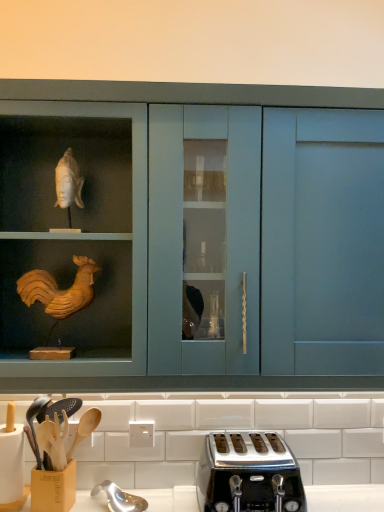
Question: Does wooden utensil holder at lower left appear on the left side of polished chrome toaster at lower center?

Choices:
 (A) no
 (B) yes

Answer: (B)

Question: Can you confirm if wooden utensil holder at lower left is shorter than polished chrome toaster at lower center?

Choices:
 (A) yes
 (B) no

Answer: (B)

Question: Is wooden utensil holder at lower left bigger than polished chrome toaster at lower center?

Choices:
 (A) no
 (B) yes

Answer: (A)

Question: Does wooden utensil holder at lower left have a greater height compared to polished chrome toaster at lower center?

Choices:
 (A) yes
 (B) no

Answer: (A)

Question: Considering the relative sizes of wooden utensil holder at lower left and polished chrome toaster at lower center in the image provided, is wooden utensil holder at lower left wider than polished chrome toaster at lower center?

Choices:
 (A) yes
 (B) no

Answer: (B)

Question: From a real-world perspective, does wooden utensil holder at lower left sit lower than polished chrome toaster at lower center?

Choices:
 (A) yes
 (B) no

Answer: (B)

Question: Is polished chrome toaster at lower center positioned beyond the bounds of wooden utensil holder at lower left?

Choices:
 (A) no
 (B) yes

Answer: (B)

Question: Is polished chrome toaster at lower center to the left of wooden utensil holder at lower left from the viewer's perspective?

Choices:
 (A) yes
 (B) no

Answer: (B)

Question: Is polished chrome toaster at lower center taller than wooden utensil holder at lower left?

Choices:
 (A) yes
 (B) no

Answer: (B)

Question: Does polished chrome toaster at lower center have a larger size compared to wooden utensil holder at lower left?

Choices:
 (A) yes
 (B) no

Answer: (A)

Question: Does polished chrome toaster at lower center have a smaller size compared to wooden utensil holder at lower left?

Choices:
 (A) yes
 (B) no

Answer: (B)

Question: From the image's perspective, would you say polished chrome toaster at lower center is positioned over wooden utensil holder at lower left?

Choices:
 (A) yes
 (B) no

Answer: (B)

Question: Is matte blue cabinet at center turned away from wooden utensil holder at lower left?

Choices:
 (A) yes
 (B) no

Answer: (B)